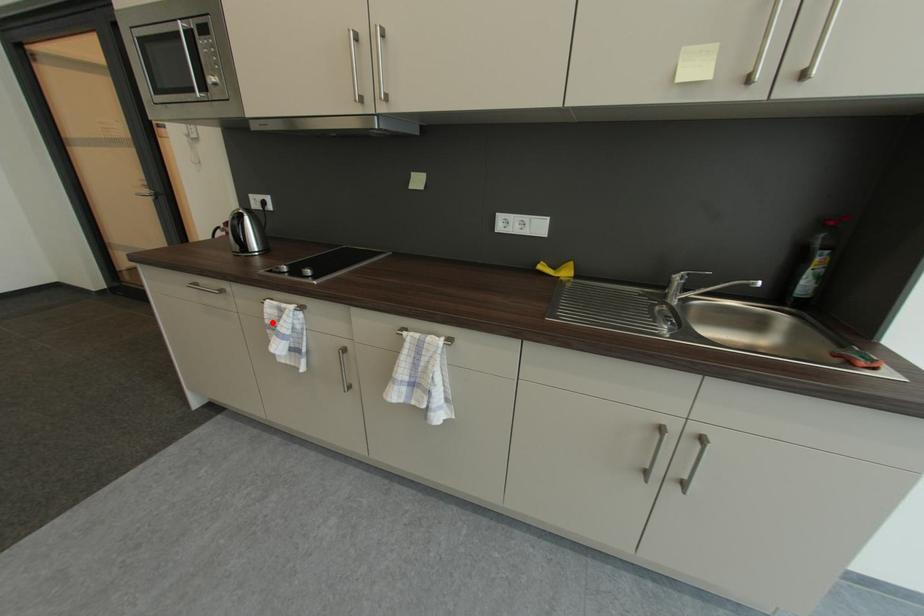
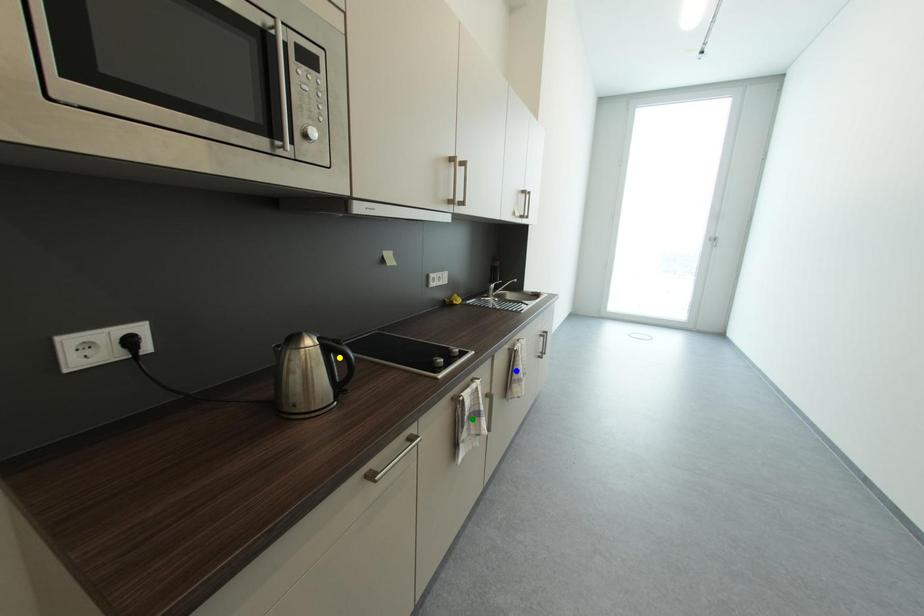
Question: I am providing you with two images of the same scene from different viewpoints. A red point is marked on the first image. You are given multiple points on the second image. Which point in image 2 represents the same 3d spot as the red point in image 1?

Choices:
 (A) yellow point
 (B) green point
 (C) blue point

Answer: (B)